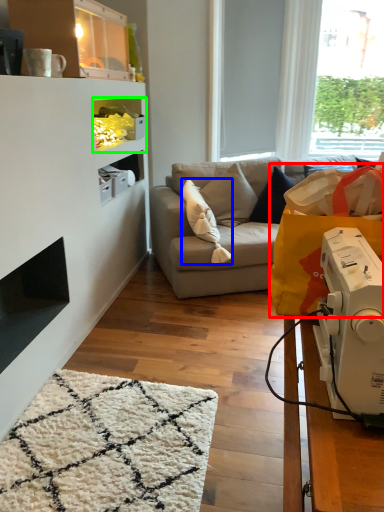
Question: Based on their relative distances, which object is farther from grocery bag (highlighted by a red box)? Choose from pillow (highlighted by a blue box) and shelf (highlighted by a green box).

Choices:
 (A) pillow
 (B) shelf

Answer: (B)